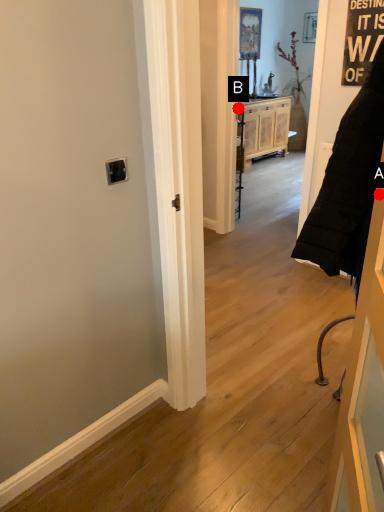
Question: Two points are circled on the image, labeled by A and B beside each circle. Which of the following is the closest to the observer?

Choices:
 (A) A is closer
 (B) B is closer

Answer: (A)